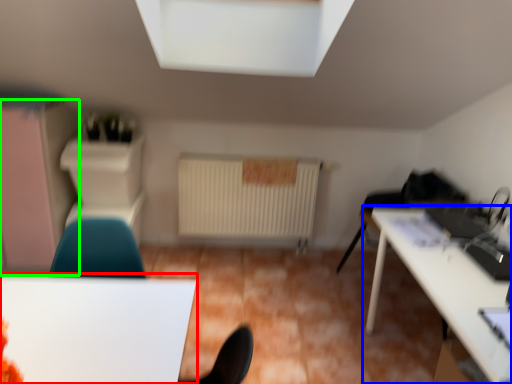
Question: Estimate the real-world distances between objects in this image. Which object is farther from table (highlighted by a red box), table (highlighted by a blue box) or dresser (highlighted by a green box)?

Choices:
 (A) table
 (B) dresser

Answer: (B)